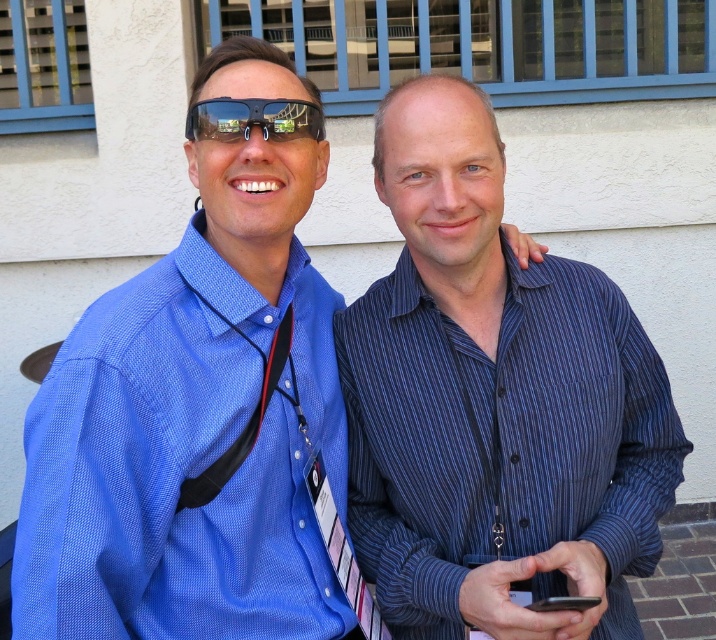
Question: Is matte black sunglasses at center above black leather tie at center?

Choices:
 (A) no
 (B) yes

Answer: (B)

Question: Which point appears farthest from the camera in this image?

Choices:
 (A) (422, 468)
 (B) (553, 605)
 (C) (314, 544)
 (D) (296, 109)

Answer: (A)

Question: Can you confirm if black leather tie at center is bigger than black matte smartphone at lower center?

Choices:
 (A) yes
 (B) no

Answer: (A)

Question: Which of these objects is positioned farthest from the black matte smartphone at lower center?

Choices:
 (A) matte black sunglasses at center
 (B) blue striped shirt at center
 (C) black leather tie at center

Answer: (A)

Question: Estimate the real-world distances between objects in this image. Which object is farther from the black leather tie at center?

Choices:
 (A) blue striped shirt at center
 (B) matte black sunglasses at center

Answer: (A)

Question: Is matte blue dress shirt at left bigger than black matte smartphone at lower center?

Choices:
 (A) yes
 (B) no

Answer: (A)